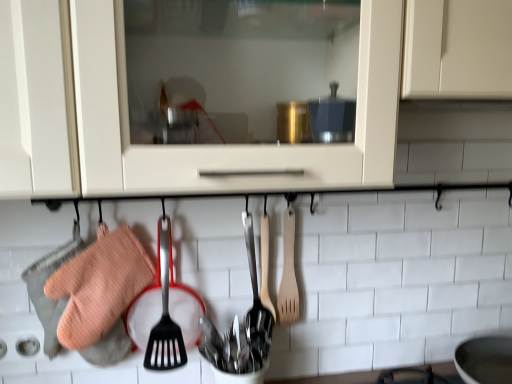
What do you see at coordinates (265, 263) in the screenshot?
I see `wooden spatula at center, which is the second spatula in right-to-left order` at bounding box center [265, 263].

Identify the location of polished stainless steel spoons at center, acting as the second silverware starting from the bottom. (256, 304).

The width and height of the screenshot is (512, 384). I want to click on wooden spatula at center-right, the second spatula positioned from the left, so (288, 269).

Where is `polished stainless steel cutlery at center, which is the second silverware in top-to-bottom order`? The width and height of the screenshot is (512, 384). polished stainless steel cutlery at center, which is the second silverware in top-to-bottom order is located at coordinates point(239,343).

Between point (268, 331) and point (80, 331), which one is positioned in front?

The point (80, 331) is closer to the camera.

Can you confirm if polished stainless steel cutlery at center, marked as the first silverware in a bottom-to-top arrangement, is bigger than orange waffle oven mitt at left?

No.

Locate an element on the screen. material above the polished stainless steel cutlery at center, marked as the first silverware in a bottom-to-top arrangement (from the image's perspective) is located at coordinates (99, 286).

From the image's perspective, who appears lower, polished stainless steel cutlery at center, which is the second silverware in top-to-bottom order, or orange waffle oven mitt at left?

polished stainless steel cutlery at center, which is the second silverware in top-to-bottom order, from the image's perspective.

Is wooden spatula at center, which is the second spatula in right-to-left order, outside of wooden spatula at center-right, which ranks as the first spatula in right-to-left order?

Yes, wooden spatula at center, which is the second spatula in right-to-left order, is not within wooden spatula at center-right, which ranks as the first spatula in right-to-left order.

From the image's perspective, would you say wooden spatula at center, which is the second spatula in right-to-left order, is shown under wooden spatula at center-right, which ranks as the first spatula in right-to-left order?

Yes, from the image's perspective, wooden spatula at center, which is the second spatula in right-to-left order, is below wooden spatula at center-right, which ranks as the first spatula in right-to-left order.

Is wooden spatula at center, the first spatula positioned from the left, not close to wooden spatula at center-right, the second spatula positioned from the left?

No, wooden spatula at center, the first spatula positioned from the left, is in close proximity to wooden spatula at center-right, the second spatula positioned from the left.

In the scene shown: Does wooden spatula at center, the first spatula positioned from the left, turn towards wooden spatula at center-right, which ranks as the first spatula in right-to-left order?

No.

Are polished stainless steel cutlery at center, which is the second silverware in top-to-bottom order, and wooden spatula at center-right, which ranks as the first spatula in right-to-left order, beside each other?

There is a gap between polished stainless steel cutlery at center, which is the second silverware in top-to-bottom order, and wooden spatula at center-right, which ranks as the first spatula in right-to-left order.

From a real-world perspective, relative to wooden spatula at center-right, which ranks as the first spatula in right-to-left order, is polished stainless steel cutlery at center, marked as the first silverware in a bottom-to-top arrangement, vertically above or below?

From a real-world perspective, polished stainless steel cutlery at center, marked as the first silverware in a bottom-to-top arrangement, is physically below wooden spatula at center-right, which ranks as the first spatula in right-to-left order.

Does point (258, 362) come closer to viewer compared to point (291, 269)?

Yes, it is in front of point (291, 269).

Is wooden spatula at center, the first spatula positioned from the left, oriented away from polished stainless steel cutlery at center, which is the second silverware in top-to-bottom order?

wooden spatula at center, the first spatula positioned from the left, is not turned away from polished stainless steel cutlery at center, which is the second silverware in top-to-bottom order.

Does wooden spatula at center, the first spatula positioned from the left, touch polished stainless steel cutlery at center, which is the second silverware in top-to-bottom order?

No, wooden spatula at center, the first spatula positioned from the left, is not in contact with polished stainless steel cutlery at center, which is the second silverware in top-to-bottom order.

Which is more to the left, wooden spatula at center, the first spatula positioned from the left, or polished stainless steel cutlery at center, marked as the first silverware in a bottom-to-top arrangement?

Positioned to the left is polished stainless steel cutlery at center, marked as the first silverware in a bottom-to-top arrangement.

Locate an element on the screen. Image resolution: width=512 pixels, height=384 pixels. the 2nd silverware positioned below the wooden spatula at center, the first spatula positioned from the left (from a real-world perspective) is located at coordinates (239, 343).

Does point (268, 227) appear closer or farther from the camera than point (260, 365)?

Point (268, 227) is positioned farther from the camera compared to point (260, 365).

From the image's perspective, is wooden spatula at center, which is the second spatula in right-to-left order, above or below polished stainless steel spoons at center, which ranks as the 1th silverware in top-to-bottom order?

wooden spatula at center, which is the second spatula in right-to-left order, is situated higher than polished stainless steel spoons at center, which ranks as the 1th silverware in top-to-bottom order, in the image.

Which of these two, wooden spatula at center, which is the second spatula in right-to-left order, or polished stainless steel spoons at center, which ranks as the 1th silverware in top-to-bottom order, is smaller?

With smaller size is wooden spatula at center, which is the second spatula in right-to-left order.

Can you see wooden spatula at center-right, which ranks as the first spatula in right-to-left order, touching wooden spatula at center, which is the second spatula in right-to-left order?

Yes, wooden spatula at center-right, which ranks as the first spatula in right-to-left order, is touching wooden spatula at center, which is the second spatula in right-to-left order.

Which of these two, wooden spatula at center-right, which ranks as the first spatula in right-to-left order, or wooden spatula at center, which is the second spatula in right-to-left order, is thinner?

wooden spatula at center, which is the second spatula in right-to-left order, is thinner.

Which point is more forward, (288, 298) or (263, 293)?

The point (263, 293) is in front.

What's the angular difference between wooden spatula at center-right, which ranks as the first spatula in right-to-left order, and wooden spatula at center, the first spatula positioned from the left,'s facing directions?

0.00147 degrees separate the facing orientations of wooden spatula at center-right, which ranks as the first spatula in right-to-left order, and wooden spatula at center, the first spatula positioned from the left.

From a real-world perspective, is polished stainless steel cutlery at center, marked as the first silverware in a bottom-to-top arrangement, physically located above or below polished stainless steel spoons at center, which ranks as the 1th silverware in top-to-bottom order?

polished stainless steel cutlery at center, marked as the first silverware in a bottom-to-top arrangement, is below polished stainless steel spoons at center, which ranks as the 1th silverware in top-to-bottom order.

From the image's perspective, relative to polished stainless steel spoons at center, acting as the second silverware starting from the bottom, is polished stainless steel cutlery at center, marked as the first silverware in a bottom-to-top arrangement, above or below?

polished stainless steel cutlery at center, marked as the first silverware in a bottom-to-top arrangement, is situated lower than polished stainless steel spoons at center, acting as the second silverware starting from the bottom, in the image.

Would you say polished stainless steel cutlery at center, which is the second silverware in top-to-bottom order, is outside polished stainless steel spoons at center, which ranks as the 1th silverware in top-to-bottom order?

polished stainless steel cutlery at center, which is the second silverware in top-to-bottom order, is positioned outside polished stainless steel spoons at center, which ranks as the 1th silverware in top-to-bottom order.

Where is `silverware below the orange waffle oven mitt at left (from the image's perspective)`? The width and height of the screenshot is (512, 384). silverware below the orange waffle oven mitt at left (from the image's perspective) is located at coordinates (239, 343).

I want to click on spatula below the wooden spatula at center-right, the second spatula positioned from the left (from a real-world perspective), so click(265, 263).

Looking at the image, which one is located further to polished stainless steel spoons at center, which ranks as the 1th silverware in top-to-bottom order, wooden spatula at center, the first spatula positioned from the left, or wooden spatula at center-right, the second spatula positioned from the left?

wooden spatula at center-right, the second spatula positioned from the left.

Looking at the image, which one is located further to wooden spatula at center, the first spatula positioned from the left, polished stainless steel cutlery at center, which is the second silverware in top-to-bottom order, or orange waffle oven mitt at left?

orange waffle oven mitt at left.

When comparing their distances from wooden spatula at center-right, the second spatula positioned from the left, does polished stainless steel spoons at center, which ranks as the 1th silverware in top-to-bottom order, or orange waffle oven mitt at left seem closer?

The object closer to wooden spatula at center-right, the second spatula positioned from the left, is polished stainless steel spoons at center, which ranks as the 1th silverware in top-to-bottom order.

Considering their positions, is polished stainless steel cutlery at center, marked as the first silverware in a bottom-to-top arrangement, positioned closer to polished stainless steel spoons at center, acting as the second silverware starting from the bottom, than wooden spatula at center-right, which ranks as the first spatula in right-to-left order?

polished stainless steel cutlery at center, marked as the first silverware in a bottom-to-top arrangement.

Considering their positions, is polished stainless steel spoons at center, acting as the second silverware starting from the bottom, positioned closer to orange waffle oven mitt at left than wooden spatula at center-right, which ranks as the first spatula in right-to-left order?

Among the two, polished stainless steel spoons at center, acting as the second silverware starting from the bottom, is located nearer to orange waffle oven mitt at left.

Considering their positions, is wooden spatula at center-right, which ranks as the first spatula in right-to-left order, positioned closer to polished stainless steel cutlery at center, marked as the first silverware in a bottom-to-top arrangement, than orange waffle oven mitt at left?

Based on the image, wooden spatula at center-right, which ranks as the first spatula in right-to-left order, appears to be nearer to polished stainless steel cutlery at center, marked as the first silverware in a bottom-to-top arrangement.

From the image, which object appears to be nearer to polished stainless steel cutlery at center, marked as the first silverware in a bottom-to-top arrangement, wooden spatula at center, the first spatula positioned from the left, or wooden spatula at center-right, which ranks as the first spatula in right-to-left order?

The object closer to polished stainless steel cutlery at center, marked as the first silverware in a bottom-to-top arrangement, is wooden spatula at center, the first spatula positioned from the left.

Consider the image. Estimate the real-world distances between objects in this image. Which object is further from polished stainless steel cutlery at center, which is the second silverware in top-to-bottom order, orange waffle oven mitt at left or wooden spatula at center, which is the second spatula in right-to-left order?

orange waffle oven mitt at left lies further to polished stainless steel cutlery at center, which is the second silverware in top-to-bottom order, than the other object.

You are a GUI agent. You are given a task and a screenshot of the screen. Output one action in this format:
    pyautogui.click(x=<x>, y=<y>)
    Task: Click on the spatula between polished stainless steel spoons at center, acting as the second silverware starting from the bottom, and wooden spatula at center-right, the second spatula positioned from the left, in the horizontal direction
    This screenshot has height=384, width=512.
    Given the screenshot: What is the action you would take?
    pyautogui.click(x=265, y=263)

Where is `silverware between wooden spatula at center-right, which ranks as the first spatula in right-to-left order, and polished stainless steel cutlery at center, marked as the first silverware in a bottom-to-top arrangement, in the up-down direction`? The height and width of the screenshot is (384, 512). silverware between wooden spatula at center-right, which ranks as the first spatula in right-to-left order, and polished stainless steel cutlery at center, marked as the first silverware in a bottom-to-top arrangement, in the up-down direction is located at coordinates (256, 304).

Where is `spatula between orange waffle oven mitt at left and wooden spatula at center-right, which ranks as the first spatula in right-to-left order, from left to right`? spatula between orange waffle oven mitt at left and wooden spatula at center-right, which ranks as the first spatula in right-to-left order, from left to right is located at coordinates (265, 263).

Locate an element on the screen. silverware between orange waffle oven mitt at left and polished stainless steel spoons at center, acting as the second silverware starting from the bottom, in the horizontal direction is located at coordinates (239, 343).